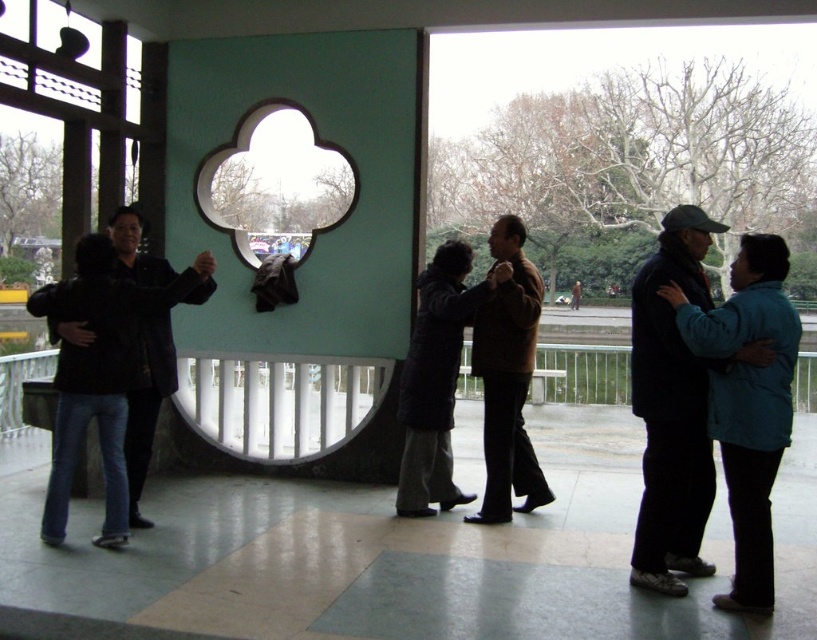
Which is in front, point (110, 472) or point (63, 321)?

Point (63, 321) is more forward.

How much distance is there between dark blue jeans at left and black matte jacket at left?

dark blue jeans at left is 38.44 centimeters away from black matte jacket at left.

Is point (119, 500) in front of point (128, 426)?

Yes, point (119, 500) is closer to viewer.

Locate an element on the screen. The height and width of the screenshot is (640, 817). dark blue jeans at left is located at coordinates (88, 385).

Who is lower down, dark gray wool coat at center or brown wool coat at center?

dark gray wool coat at center is below.

Which is above, dark gray wool coat at center or brown wool coat at center?

brown wool coat at center is above.

Find the location of a particular element. dark gray wool coat at center is located at coordinates (435, 380).

Does white plastic window at center have a smaller size compared to green matte window at center?

Indeed, white plastic window at center has a smaller size compared to green matte window at center.

Is point (224, 440) positioned in front of point (243, 205)?

Yes, it is.

What are the coordinates of `white plastic window at center` in the screenshot? It's located at (279, 403).